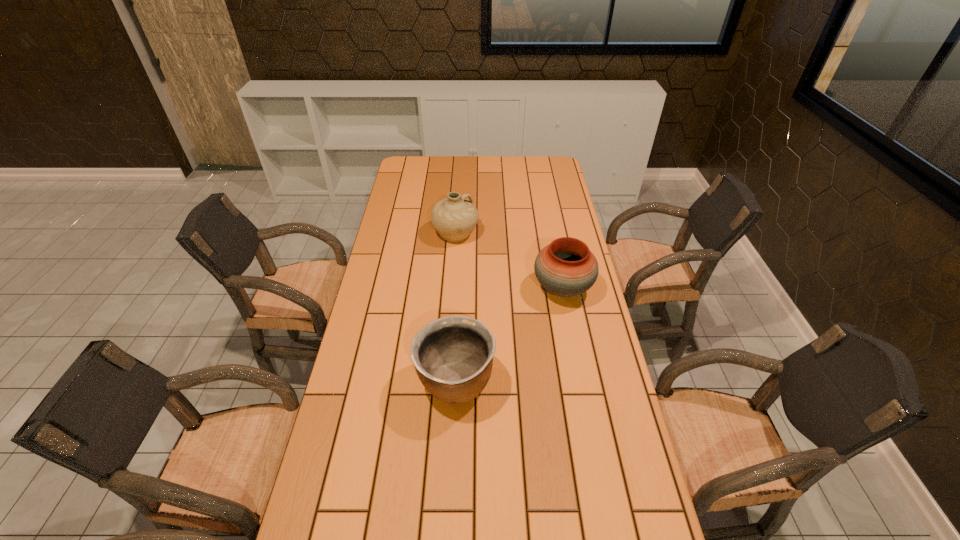
Identify the location of vacant area at the right edge of the desktop. This screenshot has height=540, width=960. (573, 335).

You are a GUI agent. You are given a task and a screenshot of the screen. Output one action in this format:
    pyautogui.click(x=<x>, y=<y>)
    Task: Click on the vacant space at the far left corner of the desktop
    
    Given the screenshot: What is the action you would take?
    pyautogui.click(x=421, y=156)

I want to click on free space between the nearest pottery and the farthest pottery, so click(455, 308).

You are a GUI agent. You are given a task and a screenshot of the screen. Output one action in this format:
    pyautogui.click(x=<x>, y=<y>)
    Task: Click on the vacant area between the second farthest object and the farthest object
    
    Given the screenshot: What is the action you would take?
    pyautogui.click(x=509, y=261)

Identify the location of free area in between the farthest pottery and the second nearest pottery. The image size is (960, 540). (509, 261).

Where is `the second closest object to the farthest object`? Image resolution: width=960 pixels, height=540 pixels. the second closest object to the farthest object is located at coordinates (453, 356).

Identify which object is the second closest to the farthest pottery. Please provide its 2D coordinates. Your answer should be formatted as a tuple, i.e. [(x, y)], where the tuple contains the x and y coordinates of a point satisfying the conditions above.

[(453, 356)]

This screenshot has height=540, width=960. In order to click on the closest pottery relative to the farthest object in this screenshot , I will do `click(566, 267)`.

The image size is (960, 540). I want to click on the closest pottery to the nearest pottery, so click(566, 267).

Where is `vacant space that satisfies the following two spatial constraints: 1. on the back side of the rightmost object; 2. on the right side of the nearest object`? The width and height of the screenshot is (960, 540). vacant space that satisfies the following two spatial constraints: 1. on the back side of the rightmost object; 2. on the right side of the nearest object is located at coordinates (460, 288).